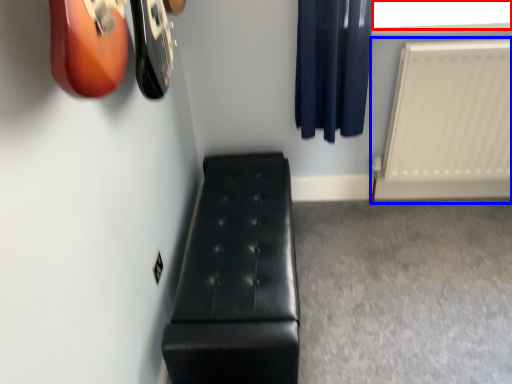
Question: Which point is further to the camera, window screen (highlighted by a red box) or radiator (highlighted by a blue box)?

Choices:
 (A) window screen
 (B) radiator

Answer: (A)